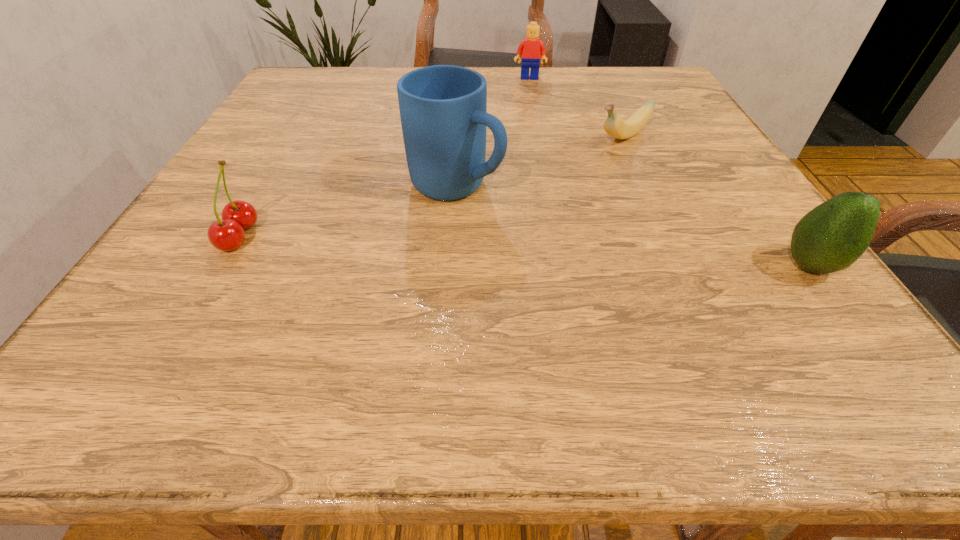
Where is `free space at the far right corner`? free space at the far right corner is located at coordinates (661, 69).

The image size is (960, 540). What are the coordinates of `free area in between the cherry and the tallest object` in the screenshot? It's located at tap(348, 211).

You are a GUI agent. You are given a task and a screenshot of the screen. Output one action in this format:
    pyautogui.click(x=<x>, y=<y>)
    Task: Click on the vacant space that is in between the farthest object and the avocado
    Image resolution: width=960 pixels, height=540 pixels.
    Given the screenshot: What is the action you would take?
    pyautogui.click(x=669, y=172)

The image size is (960, 540). Find the location of `empty space that is in between the cherry and the avocado`. empty space that is in between the cherry and the avocado is located at coordinates (524, 251).

Find the location of a particular element. This screenshot has width=960, height=540. free point between the second farthest object and the third object from left to right is located at coordinates (576, 107).

Identify the location of free point between the farthest object and the avocado. This screenshot has height=540, width=960. (669, 172).

This screenshot has height=540, width=960. I want to click on object that is the third closest to the Lego, so click(x=832, y=236).

Point out which object is positioned as the nearest to the farthest object. Please provide its 2D coordinates. Your answer should be formatted as a tuple, i.e. [(x, y)], where the tuple contains the x and y coordinates of a point satisfying the conditions above.

[(613, 125)]

Locate an element on the screen. The image size is (960, 540). vacant region that satisfies the following two spatial constraints: 1. on the back side of the third object from right to left; 2. on the right side of the fourth object from right to left is located at coordinates (463, 78).

This screenshot has height=540, width=960. In order to click on free location that satisfies the following two spatial constraints: 1. on the back side of the second object from right to left; 2. on the right side of the fourth object from right to left in this screenshot , I will do `click(459, 138)`.